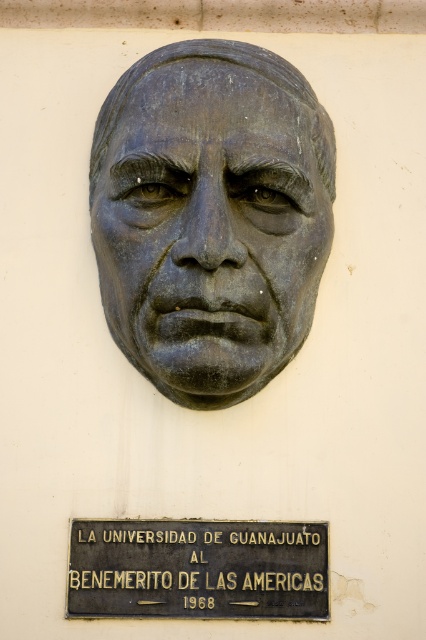
Does bronze sculpture at center appear under bronze plaque at center?

Actually, bronze sculpture at center is above bronze plaque at center.

Can you confirm if bronze sculpture at center is bigger than bronze plaque at center?

Correct, bronze sculpture at center is larger in size than bronze plaque at center.

Find the location of a particular element. Image resolution: width=426 pixels, height=640 pixels. bronze sculpture at center is located at coordinates (x=212, y=227).